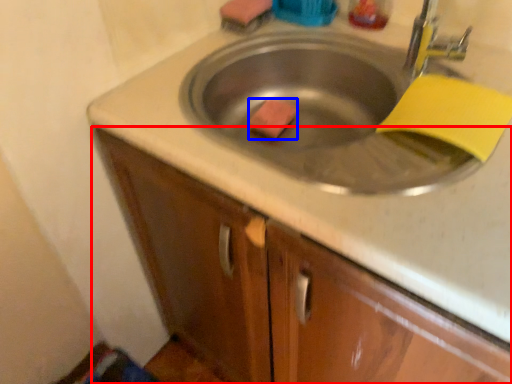
Question: Which point is further to the camera, cabinetry (highlighted by a red box) or soap (highlighted by a blue box)?

Choices:
 (A) cabinetry
 (B) soap

Answer: (B)